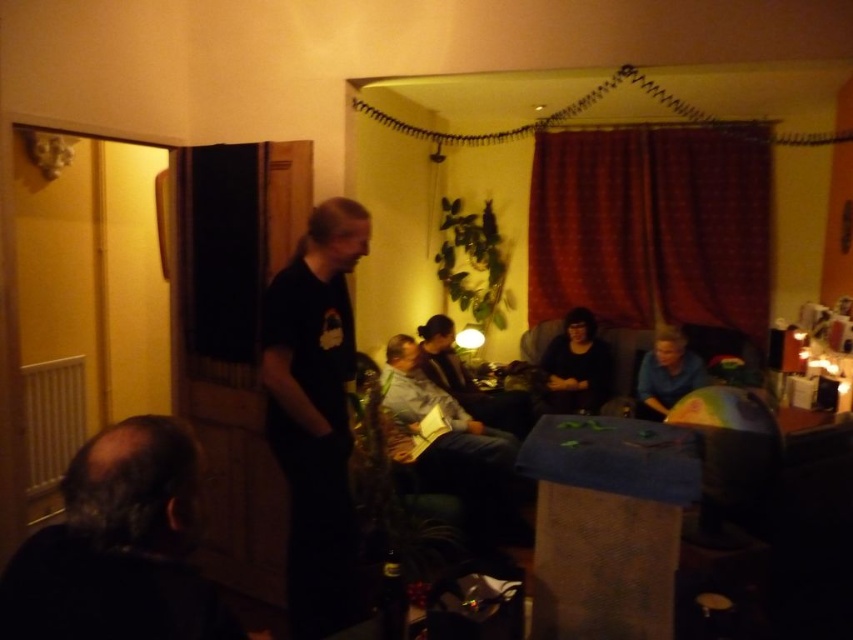
You are organizing a photo shoot and need to arrange two participants wearing the black matte shirt at left and denim jacket at center. Given their sizes, which participant should you place closer to the camera to ensure both appear proportionally sized in the final image?

The black matte shirt at left has a smaller size compared to denim jacket at center, so you should place the participant wearing the black matte shirt at left closer to the camera to balance their sizes in the photo.

You are standing at the center of the room and want to greet the person wearing the black matte shirt at left. In which direction should you move to reach them?

Since the black matte shirt at left is located at point 0.645 on the x and 0.370 on the y coordinates, you should move to the right to reach them.